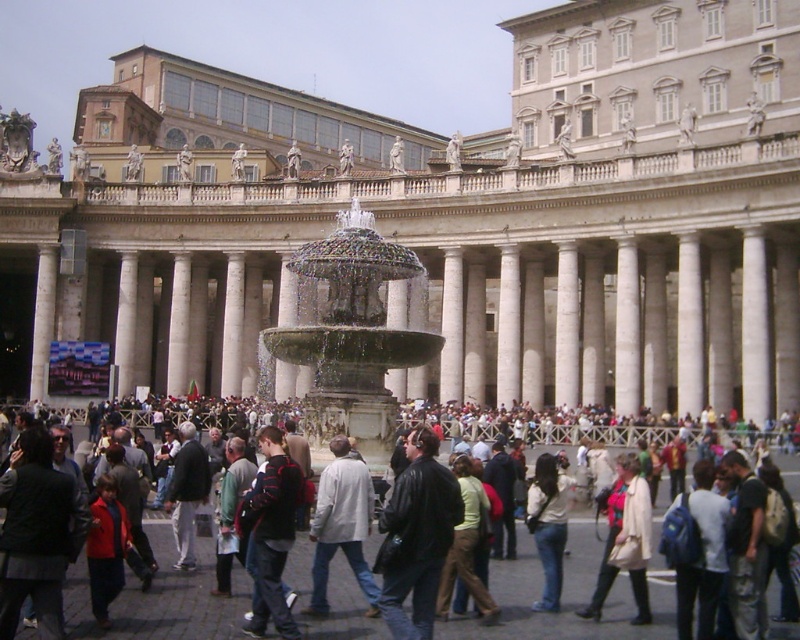
Question: Can you confirm if dark blue jeans at center is bigger than beige leather jacket at center?

Choices:
 (A) no
 (B) yes

Answer: (A)

Question: Which point is farther from the camera taking this photo?

Choices:
 (A) (384, 428)
 (B) (613, 74)
 (C) (76, 621)
 (D) (316, 540)

Answer: (B)

Question: Is white marble palace at center closer to the viewer compared to beige leather jacket at center?

Choices:
 (A) no
 (B) yes

Answer: (A)

Question: Is the position of dark gray clothing at center more distant than that of leather jacket at center?

Choices:
 (A) yes
 (B) no

Answer: (A)

Question: Estimate the real-world distances between objects in this image. Which object is farther from the dark gray clothing at center?

Choices:
 (A) leather jacket at center
 (B) white marble palace at center
 (C) beige leather jacket at center
 (D) dark gray jacket at center

Answer: (B)

Question: Which point appears farthest from the camera in this image?

Choices:
 (A) (637, 486)
 (B) (717, 524)
 (C) (194, 472)
 (D) (274, 573)

Answer: (C)